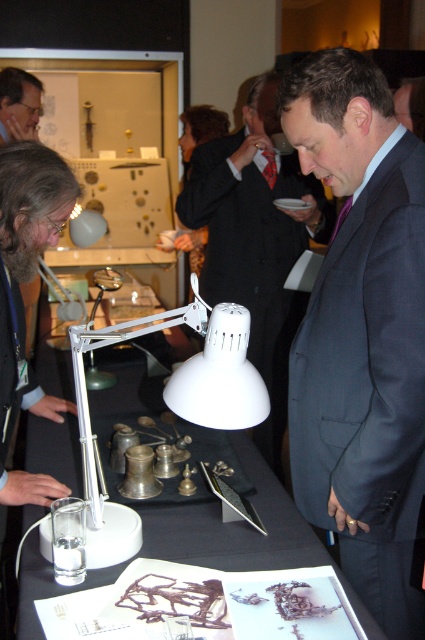
Question: Which point is farther from the camera taking this photo?

Choices:
 (A) (13, 300)
 (B) (384, 429)
 (C) (227, 356)
 (D) (118, 349)

Answer: (D)

Question: Observing the image, what is the correct spatial positioning of white plastic table at center in reference to white plastic table lamp at center?

Choices:
 (A) right
 (B) left

Answer: (B)

Question: Which point appears closest to the camera in this image?

Choices:
 (A) click(x=419, y=598)
 (B) click(x=22, y=106)
 (C) click(x=184, y=518)
 (D) click(x=252, y=109)

Answer: (C)

Question: Which object appears closest to the camera in this image?

Choices:
 (A) white plastic table lamp at center
 (B) gray fabric suit at center
 (C) dark gray suit at center
 (D) matte white lamp at center

Answer: (A)

Question: Is white plastic table lamp at center thinner than gray fabric suit at center?

Choices:
 (A) yes
 (B) no

Answer: (B)

Question: Is dark gray suit at center wider than white plastic table at center?

Choices:
 (A) yes
 (B) no

Answer: (B)